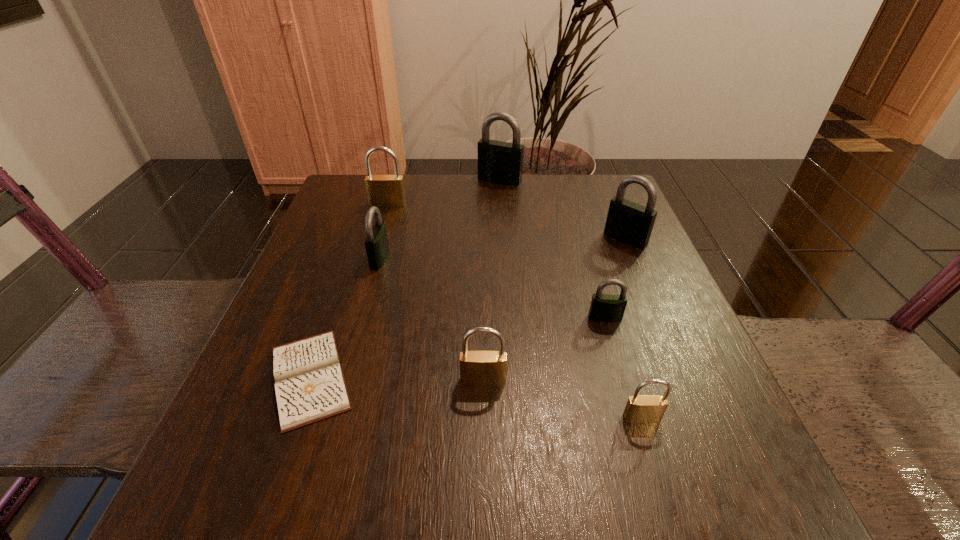
At what (x,y) coordinates should I click in order to perform the action: click on the third black padlock from right to left. Please return your answer as a coordinate pair (x, y). Looking at the image, I should click on (499, 162).

Locate an element on the screen. the farthest object is located at coordinates (499, 162).

Locate an element on the screen. The image size is (960, 540). the leftmost brass padlock is located at coordinates (386, 191).

What are the coordinates of `the seventh nearest object` in the screenshot? It's located at (386, 191).

Find the location of a particular element. This screenshot has width=960, height=540. the rightmost object is located at coordinates (630, 223).

Find the location of `the second biggest black padlock`. the second biggest black padlock is located at coordinates (630, 223).

Find the location of a particular element. This screenshot has height=540, width=960. the second smallest black padlock is located at coordinates (376, 243).

Identify the location of the sixth farthest padlock. (477, 368).

You are a GUI agent. You are given a task and a screenshot of the screen. Output one action in this format:
    pyautogui.click(x=<x>, y=<y>)
    Task: Click on the second smallest brass padlock
    The image size is (960, 540).
    Given the screenshot: What is the action you would take?
    pyautogui.click(x=477, y=368)

Where is `the second black padlock from right to left`? the second black padlock from right to left is located at coordinates (604, 307).